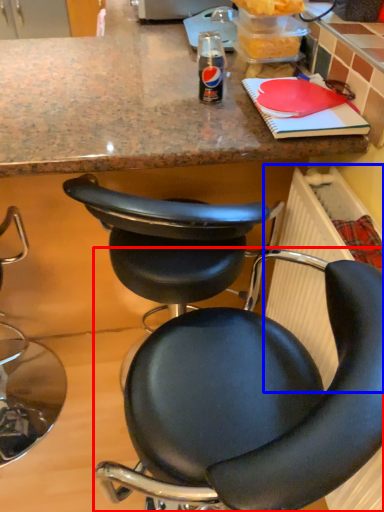
Question: Which object appears farthest to the camera in this image, chair (highlighted by a red box) or radiator (highlighted by a blue box)?

Choices:
 (A) chair
 (B) radiator

Answer: (B)